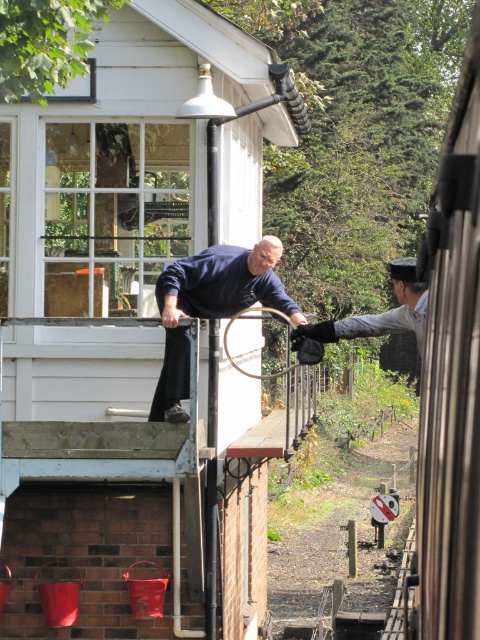
Can you confirm if blue matte shirt at center is thinner than dark gray uniform at center?

Yes, blue matte shirt at center is thinner than dark gray uniform at center.

Is blue matte shirt at center positioned at the back of dark gray uniform at center?

That is True.

Is point (156, 385) closer to camera compared to point (315, 333)?

No, (156, 385) is further to viewer.

At what (x,y) coordinates should I click in order to perform the action: click on blue matte shirt at center. Please return your answer as a coordinate pair (x, y). Looking at the image, I should click on (211, 307).

Find the location of `metallic silver train at right`. metallic silver train at right is located at coordinates (452, 378).

Where is `metallic silver train at right`? metallic silver train at right is located at coordinates (452, 378).

Which is above, metallic silver train at right or dark gray uniform at center?

metallic silver train at right is higher up.

In order to click on metallic silver train at right in this screenshot , I will do [x=452, y=378].

Is point (466, 77) positioned after point (355, 324)?

No, it is in front of (355, 324).

I want to click on metallic silver train at right, so [x=452, y=378].